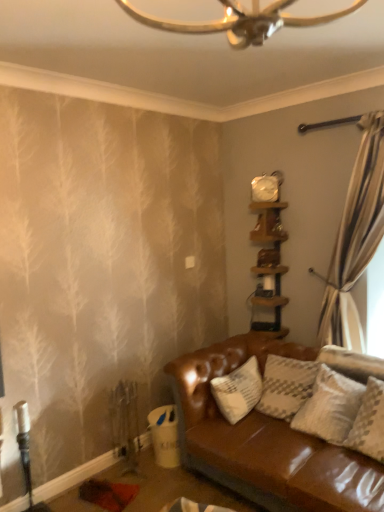
Find the location of a particular element. free spot above wooden shelf at upper right, the 1th shelf from the top (from a real-world perspective) is located at coordinates (264, 210).